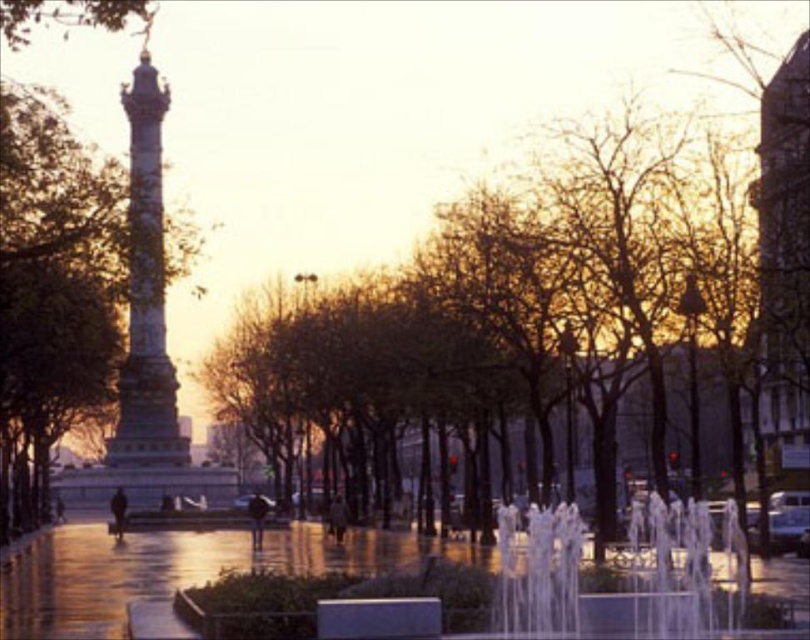
Question: Which object is closer to the camera taking this photo?

Choices:
 (A) brick textured tower at right
 (B) polished gold column at center

Answer: (A)

Question: Is brick textured tower at right closer to camera compared to polished gold column at center?

Choices:
 (A) yes
 (B) no

Answer: (A)

Question: Does brick textured tower at right have a greater width compared to polished gold column at center?

Choices:
 (A) yes
 (B) no

Answer: (B)

Question: Can you confirm if brick textured tower at right is smaller than polished gold column at center?

Choices:
 (A) yes
 (B) no

Answer: (A)